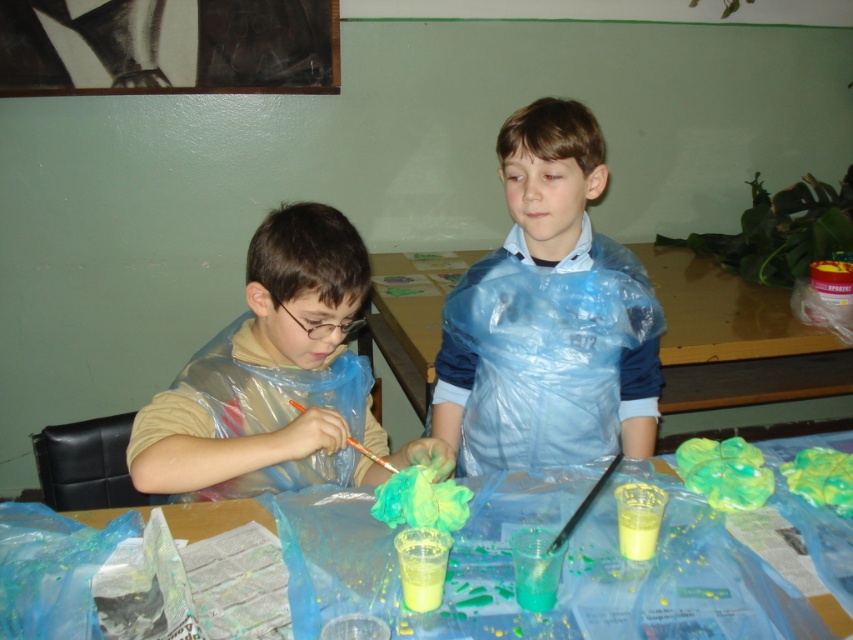
You are a teacher organizing art supplies in the classroom. You need to place a blue plastic bag at center on the translucent plastic table at center. Is there enough space between them to do this?

The translucent plastic table at center and blue plastic bag at center are 42.79 centimeters apart, so there is sufficient space to place the blue plastic bag at center on the translucent plastic table at center.

You are a teacher observing two children painting at a table. You need to check if the matte plastic apron at left is placed to the left of the wooden table at center. Can you confirm this?

The matte plastic apron at left is positioned on the left side of wooden table at center, so yes, it is placed to the left of the wooden table at center.